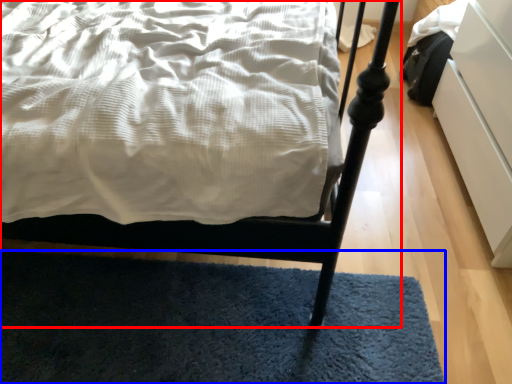
Question: Which of the following is the closest to the observer, bed (highlighted by a red box) or mat (highlighted by a blue box)?

Choices:
 (A) bed
 (B) mat

Answer: (A)